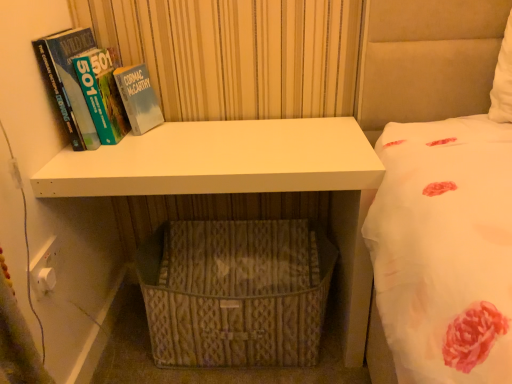
Identify the location of spots to the right of hardcover book at left. (192, 144).